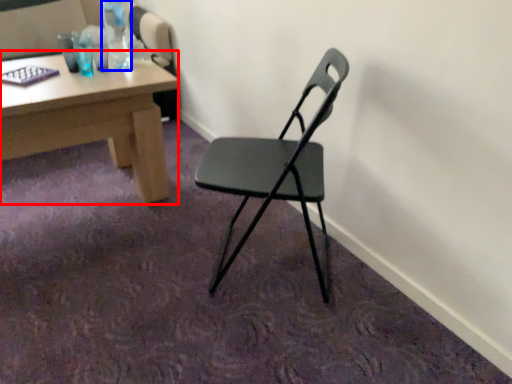
Question: Which of the following is the farthest to the observer, desk (highlighted by a red box) or bottle (highlighted by a blue box)?

Choices:
 (A) desk
 (B) bottle

Answer: (A)